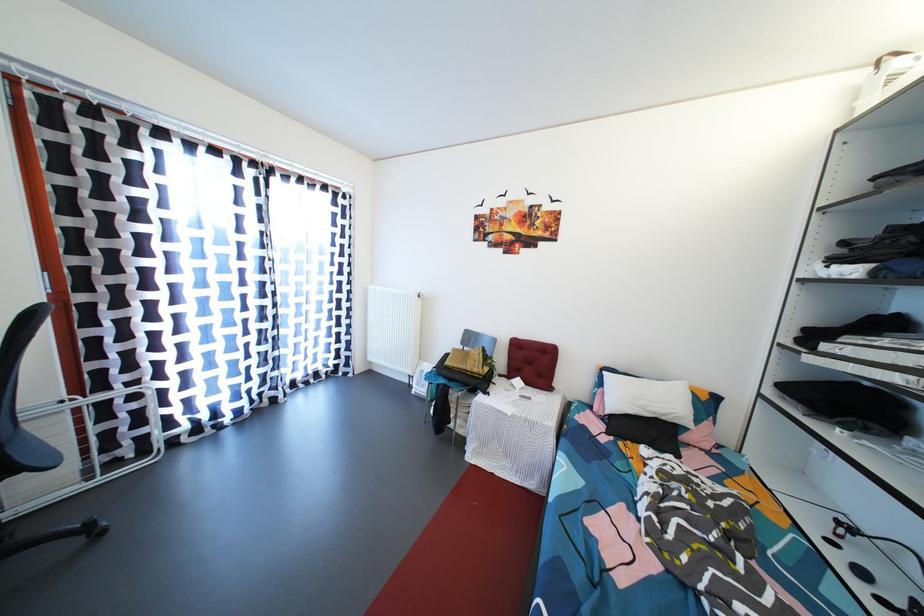
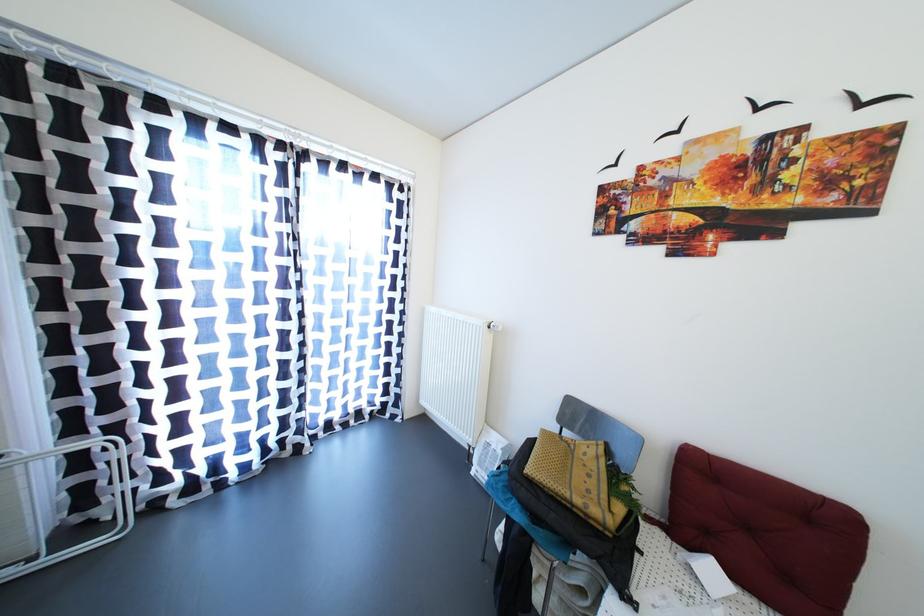
Question: The images are taken continuously from a first-person perspective. In which direction are you moving?

Choices:
 (A) Left
 (B) Right
 (C) Forward
 (D) Backward

Answer: (C)